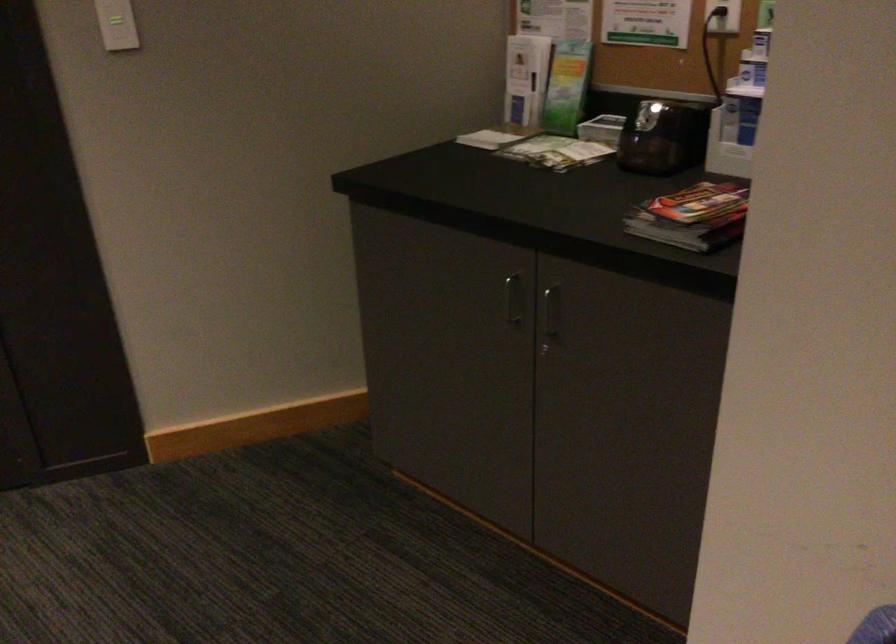
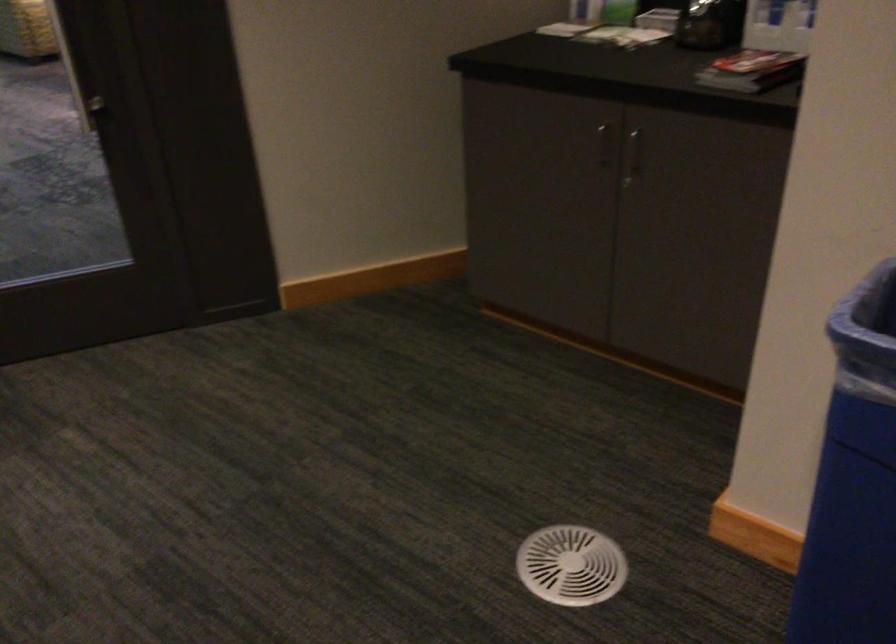
Question: Based on the continuous images, in which direction is the camera rotating? Reply with the corresponding letter.

Choices:
 (A) Left
 (B) Right
 (C) Up
 (D) Down

Answer: (D)